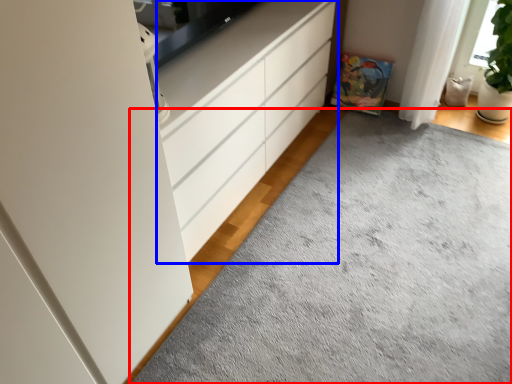
Question: Which of the following is the closest to the observer, plain (highlighted by a red box) or chest of drawers (highlighted by a blue box)?

Choices:
 (A) plain
 (B) chest of drawers

Answer: (A)